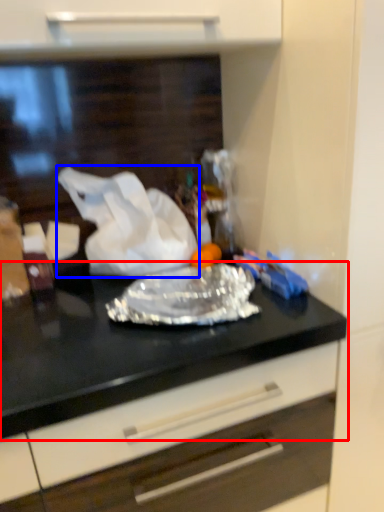
Question: Which object appears closest to the camera in this image, countertop (highlighted by a red box) or wrapping paper (highlighted by a blue box)?

Choices:
 (A) countertop
 (B) wrapping paper

Answer: (A)